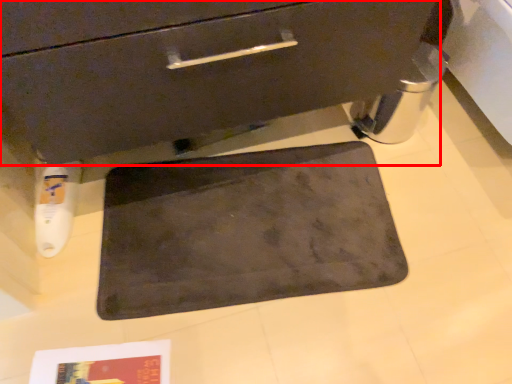
Question: From the image's perspective, what is the correct spatial relationship of drawer (annotated by the red box) in relation to bath mat?

Choices:
 (A) below
 (B) above

Answer: (B)